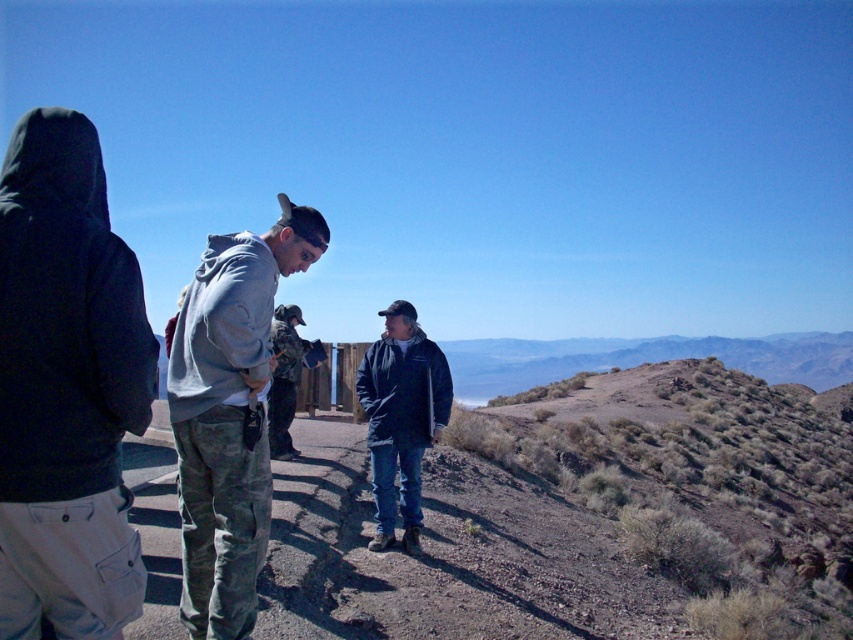
You are standing on the paved pathway in the desert and see the dark blue fleece jacket at center. If you want to reach it within 3 seconds, what is the minimum speed you must move at?

The dark blue fleece jacket at center is 6.81 meters away. To reach it in 3 seconds, you must move at a minimum speed of approximately 2.27 meters per second.

You are a hiker who wants to check the position of your two jackets. You have a dark blue fleece jacket at center and a camouflage jacket at center. According to the scene, which jacket is positioned higher?

The dark blue fleece jacket at center is located above the camouflage jacket at center, so it is positioned higher.

You are planning to take a photo of the two people in the scene. The gray fleece sweatshirt at center and the dark blue jacket at center are both in the frame. Which one appears shorter in the photo?

The gray fleece sweatshirt at center appears shorter than the dark blue jacket at center because it is not as tall as the dark blue jacket at center.